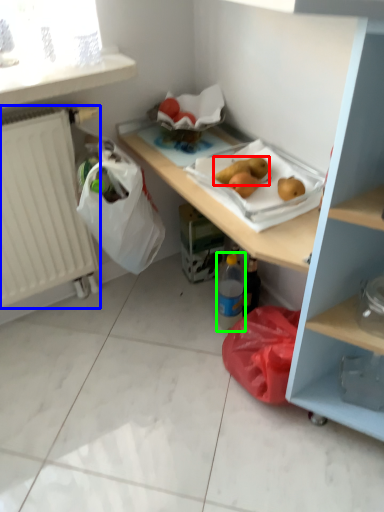
Question: Which object is the closest to the food (highlighted by a red box)? Choose among these: radiator (highlighted by a blue box) or bottle (highlighted by a green box).

Choices:
 (A) radiator
 (B) bottle

Answer: (B)